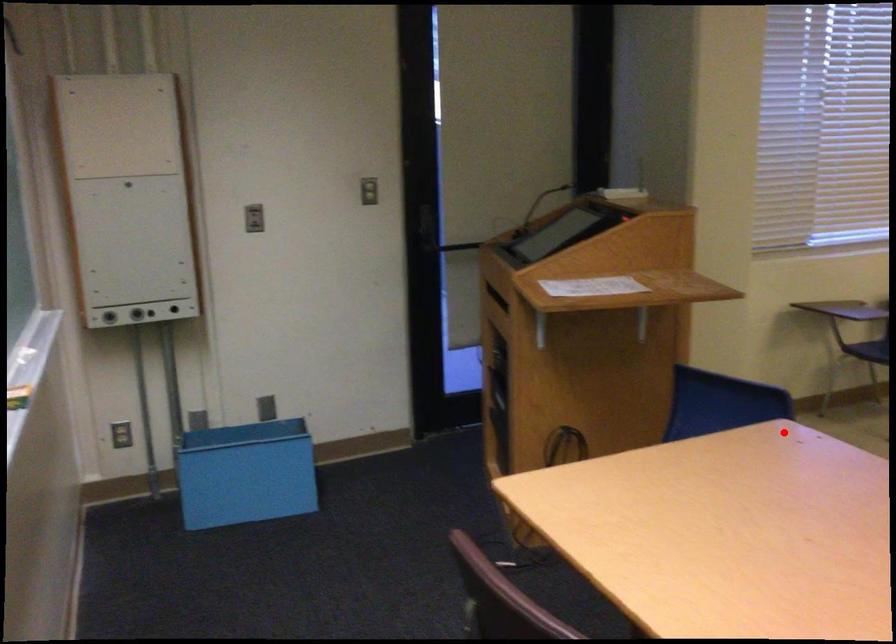
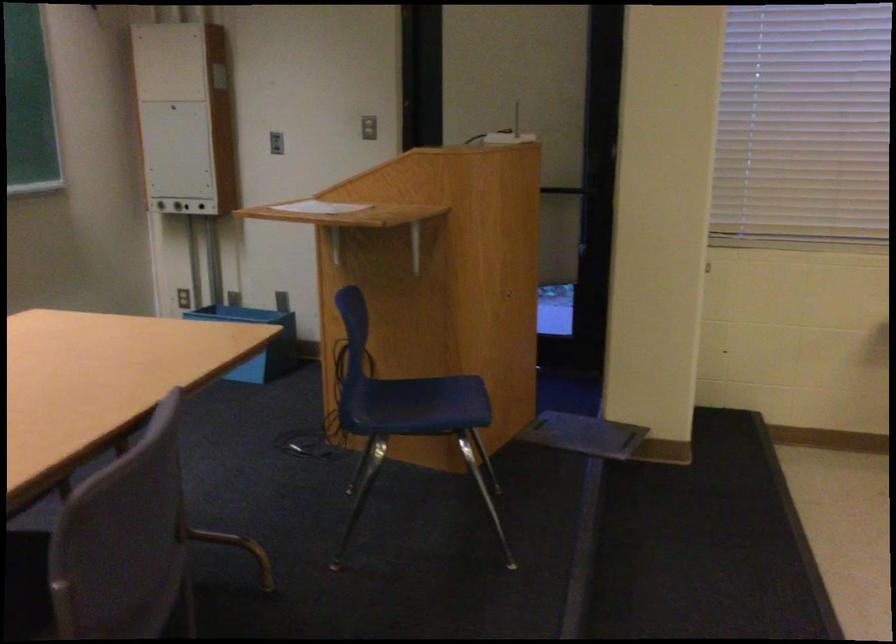
Where in the second image is the point corresponding to the highlighted location from the first image?

(256, 341)